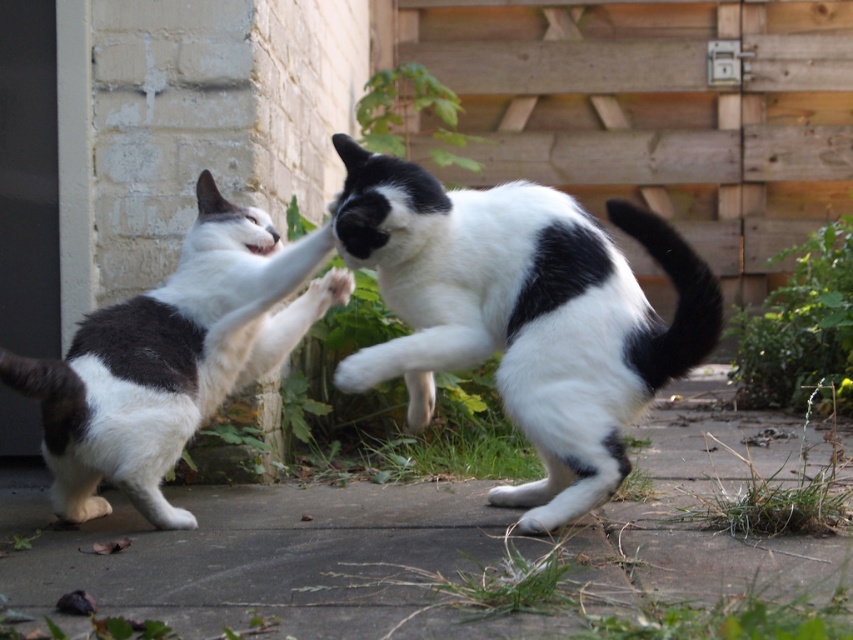
Which of these two, black and white fur cat at center or white fur cat at left, stands shorter?

Standing shorter between the two is white fur cat at left.

Is point (438, 332) closer to viewer compared to point (96, 368)?

That is True.

This screenshot has height=640, width=853. What are the coordinates of `black and white fur cat at center` in the screenshot? It's located at tap(521, 314).